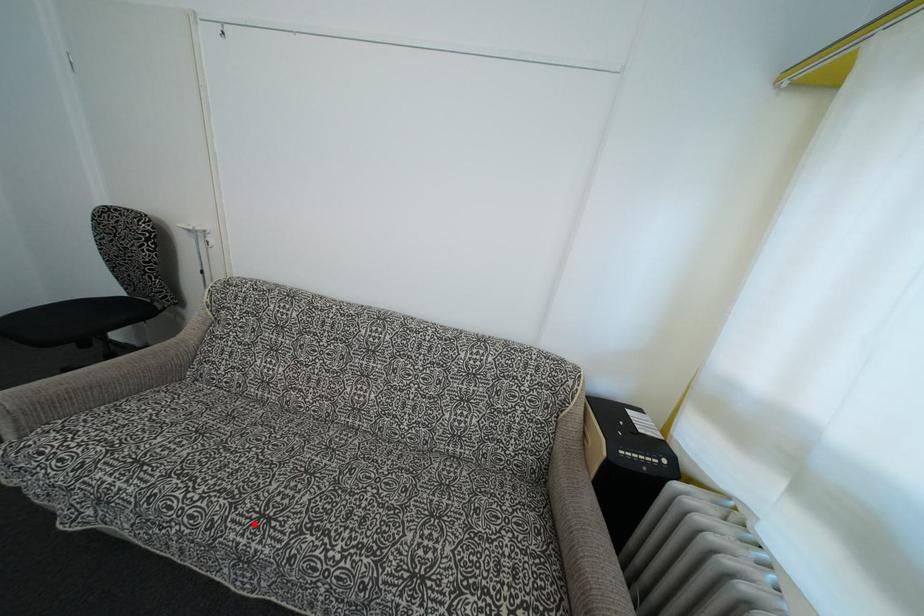
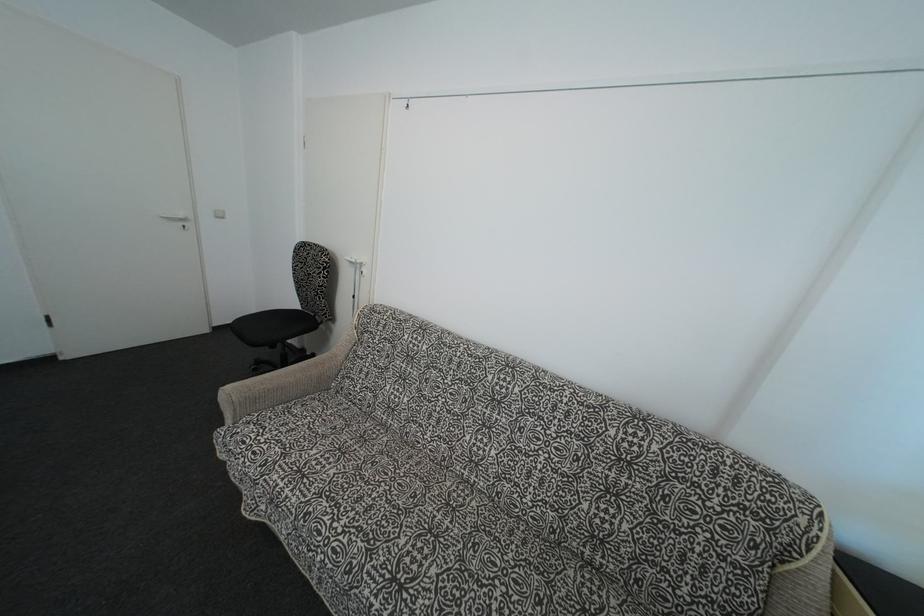
Question: I am providing you with two images of the same scene from different viewpoints. A red point is marked on the first image. Is the red point's position out of view in image 2?

Choices:
 (A) Yes
 (B) No

Answer: (B)